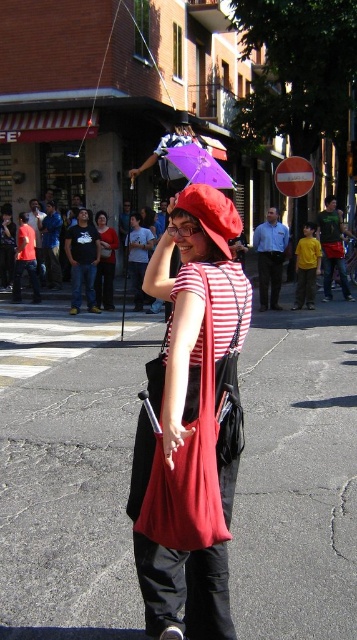
Can you confirm if red fabric hat at center is thinner than matte black shirt at center?

Yes, red fabric hat at center is thinner than matte black shirt at center.

Is red fabric hat at center bigger than matte black shirt at center?

No.

What do you see at coordinates (212, 212) in the screenshot?
I see `red fabric hat at center` at bounding box center [212, 212].

Find the location of a particular element. Image resolution: width=357 pixels, height=640 pixels. red fabric hat at center is located at coordinates (212, 212).

Can you confirm if matte red bag at center is smaller than red fabric hat at center?

Actually, matte red bag at center might be larger than red fabric hat at center.

Looking at this image, between matte red bag at center and red fabric hat at center, which one has more height?

matte red bag at center is taller.

This screenshot has width=357, height=640. Describe the element at coordinates (190, 422) in the screenshot. I see `matte red bag at center` at that location.

This screenshot has height=640, width=357. Identify the location of matte red bag at center. coord(190,422).

Who is positioned more to the left, red fabric hat at center or purple glossy umbrella at center?

red fabric hat at center is more to the left.

Can you confirm if red fabric hat at center is bigger than purple glossy umbrella at center?

Incorrect, red fabric hat at center is not larger than purple glossy umbrella at center.

Image resolution: width=357 pixels, height=640 pixels. What do you see at coordinates (212, 212) in the screenshot?
I see `red fabric hat at center` at bounding box center [212, 212].

The width and height of the screenshot is (357, 640). I want to click on red fabric hat at center, so click(x=212, y=212).